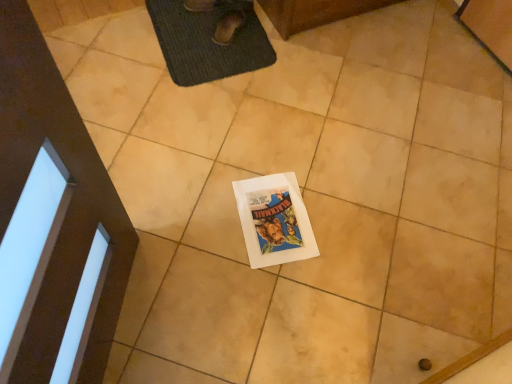
Locate an element on the screen. free space behind white paper comic book at center is located at coordinates (280, 152).